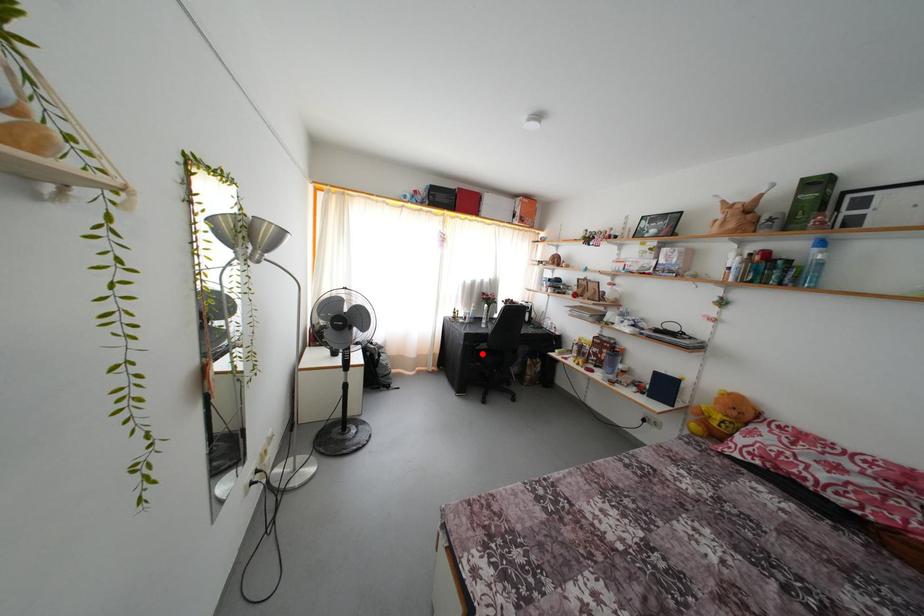
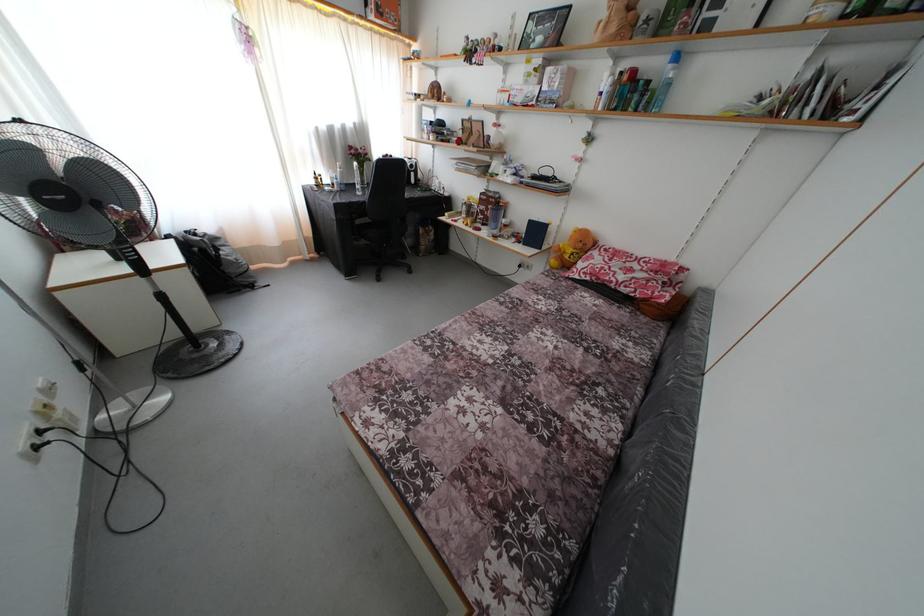
Question: I am providing you with two images of the same scene from different viewpoints. Given a red point in image1, look at the same physical point in image2. Is it:

Choices:
 (A) Closer to the viewpoint
 (B) Farther from the viewpoint

Answer: (A)